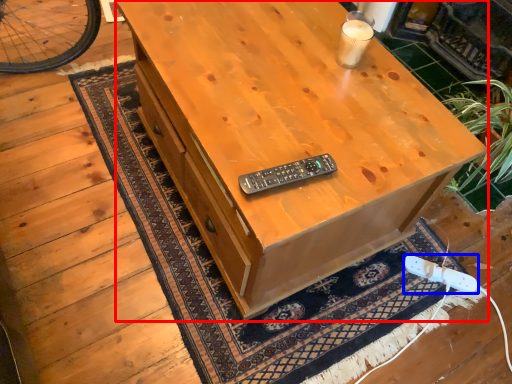
Question: Among these objects, which one is farthest to the camera, desk (highlighted by a red box) or game controller (highlighted by a blue box)?

Choices:
 (A) desk
 (B) game controller

Answer: (B)